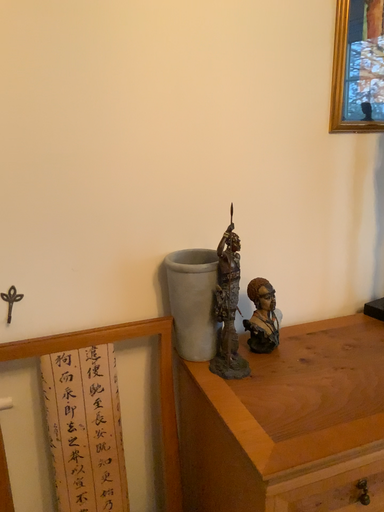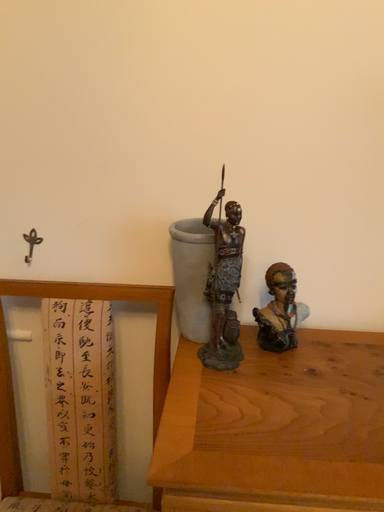
Question: Which way did the camera rotate in the video?

Choices:
 (A) rotated right
 (B) rotated left

Answer: (B)